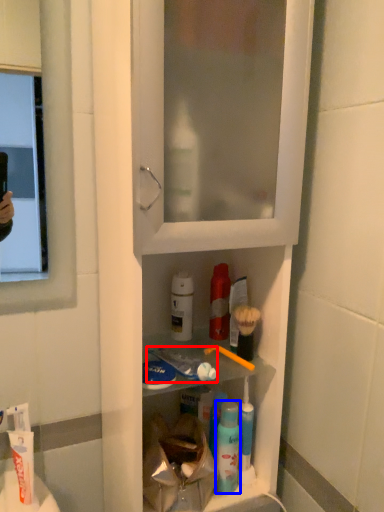
Question: Which of the following is the closest to the observer, toothpaste (highlighted by a red box) or mouthwash (highlighted by a blue box)?

Choices:
 (A) toothpaste
 (B) mouthwash

Answer: (A)